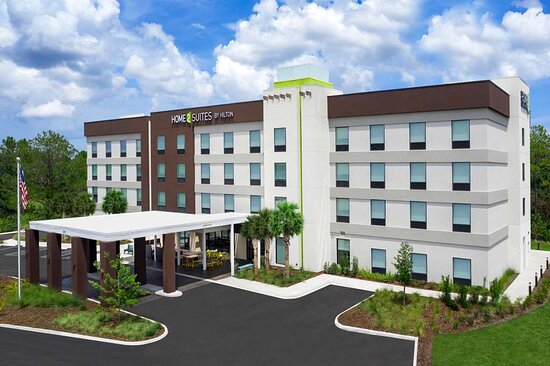
Find the location of a particular element. The height and width of the screenshot is (366, 550). finial is located at coordinates (18, 157).